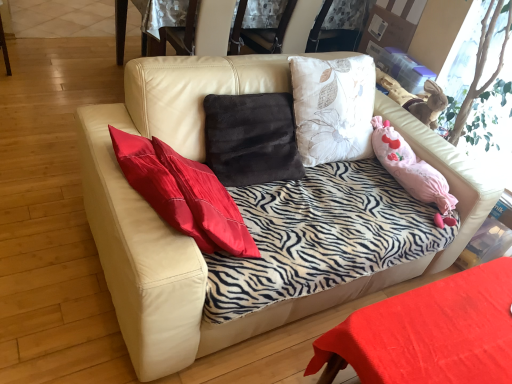
In order to face leather couch at center, should I rotate leftwards or rightwards?

You should look right and rotate roughly 4.332 degrees.

Image resolution: width=512 pixels, height=384 pixels. Identify the location of leather couch at center. (192, 239).

You are a GUI agent. You are given a task and a screenshot of the screen. Output one action in this format:
    pyautogui.click(x=<x>, y=<y>)
    Task: Click on the leather at upper center
    Image resolution: width=512 pixels, height=384 pixels.
    Given the screenshot: What is the action you would take?
    pyautogui.click(x=183, y=32)

Identify the location of leather couch at center. (192, 239).

The height and width of the screenshot is (384, 512). Find the location of `armchair above the smooth red table at lower right (from a real-world perspective)`. armchair above the smooth red table at lower right (from a real-world perspective) is located at coordinates (183, 32).

Which is more to the left, smooth red table at lower right or leather at upper center?

Positioned to the left is leather at upper center.

Considering the sizes of smooth red table at lower right and leather at upper center in the image, is smooth red table at lower right taller or shorter than leather at upper center?

In the image, smooth red table at lower right appears to be shorter than leather at upper center.

Which is behind, smooth red table at lower right or leather at upper center?

leather at upper center is behind.

Is leather couch at center smaller than leather at upper center?

Actually, leather couch at center might be larger than leather at upper center.

Are leather couch at center and leather at upper center beside each other?

No, leather couch at center is not next to leather at upper center.

How many degrees apart are the facing directions of leather couch at center and leather at upper center?

175 degrees separate the facing orientations of leather couch at center and leather at upper center.

Is leather couch at center taller than smooth red table at lower right?

Indeed, leather couch at center has a greater height compared to smooth red table at lower right.

Does leather couch at center have a larger size compared to smooth red table at lower right?

Answer: Indeed, leather couch at center has a larger size compared to smooth red table at lower right.

From the picture: From a real-world perspective, is leather couch at center physically above smooth red table at lower right?

Yes, from a real-world perspective, leather couch at center is on top of smooth red table at lower right.

Consider the image. Could you tell me if leather couch at center is facing smooth red table at lower right?

Yes.

From the picture: From the image's perspective, between smooth red table at lower right and leather couch at center, which one is located above?

leather couch at center appears higher in the image.

Considering the sizes of objects smooth red table at lower right and leather couch at center in the image provided, who is bigger, smooth red table at lower right or leather couch at center?

leather couch at center.

Considering their positions, is smooth red table at lower right located in front of or behind leather couch at center?

Clearly, smooth red table at lower right is behind leather couch at center.

Considering the relative sizes of smooth red table at lower right and leather couch at center in the image provided, is smooth red table at lower right wider than leather couch at center?

No.

From the image's perspective, is leather at upper center above smooth red table at lower right?

Yes, from the image's perspective, leather at upper center is above smooth red table at lower right.

Does point (183, 46) lie behind point (429, 314)?

Yes, point (183, 46) is farther from viewer.

From the picture: Considering the sizes of objects leather at upper center and smooth red table at lower right in the image provided, who is smaller, leather at upper center or smooth red table at lower right?

Smaller between the two is leather at upper center.

Considering the relative positions of leather at upper center and smooth red table at lower right in the image provided, is leather at upper center to the left of smooth red table at lower right from the viewer's perspective?

Yes.

Considering the sizes of leather at upper center and leather couch at center in the image, is leather at upper center taller or shorter than leather couch at center?

Considering their sizes, leather at upper center has less height than leather couch at center.

Which object is wider, leather at upper center or leather couch at center?

Wider between the two is leather couch at center.

From the image's perspective, does leather at upper center appear higher than leather couch at center?

Yes, from the image's perspective, leather at upper center is on top of leather couch at center.

Find the location of a particular element. This screenshot has width=512, height=384. armchair above the leather couch at center (from a real-world perspective) is located at coordinates (183, 32).

There is a smooth red table at lower right. Where is `armchair above it (from a real-world perspective)`? The image size is (512, 384). armchair above it (from a real-world perspective) is located at coordinates (183, 32).

Locate an element on the screen. studio couch that appears below the leather at upper center (from a real-world perspective) is located at coordinates (192, 239).

From the image, which object appears to be nearer to leather couch at center, leather at upper center or smooth red table at lower right?

The object closer to leather couch at center is smooth red table at lower right.

Based on their spatial positions, is leather couch at center or smooth red table at lower right further from leather at upper center?

smooth red table at lower right is further to leather at upper center.

When comparing their distances from smooth red table at lower right, does leather at upper center or leather couch at center seem closer?

The object closer to smooth red table at lower right is leather couch at center.

From the image, which object appears to be nearer to smooth red table at lower right, leather couch at center or leather at upper center?

Based on the image, leather couch at center appears to be nearer to smooth red table at lower right.

Estimate the real-world distances between objects in this image. Which object is closer to leather couch at center, smooth red table at lower right or leather at upper center?

smooth red table at lower right is closer to leather couch at center.

When comparing their distances from leather at upper center, does smooth red table at lower right or leather couch at center seem further?

Based on the image, smooth red table at lower right appears to be further to leather at upper center.

What are the coordinates of `studio couch between leather at upper center and smooth red table at lower right from top to bottom` in the screenshot? It's located at (192, 239).